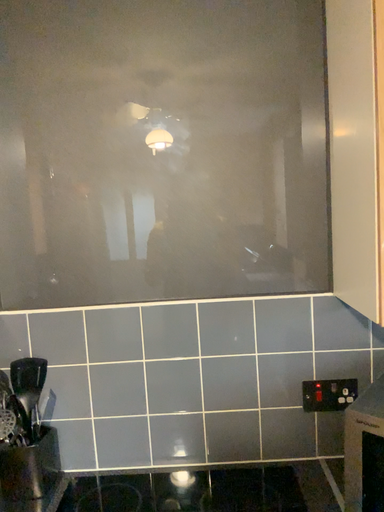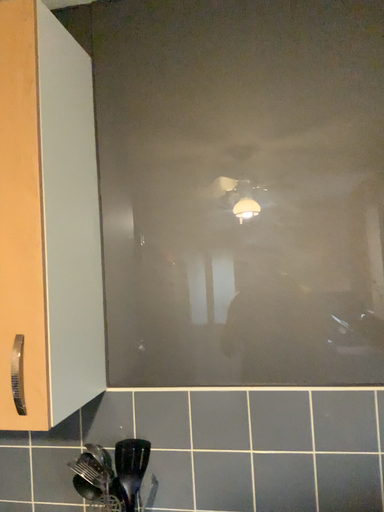
Question: Which way did the camera rotate in the video?

Choices:
 (A) rotated downward
 (B) rotated upward

Answer: (B)